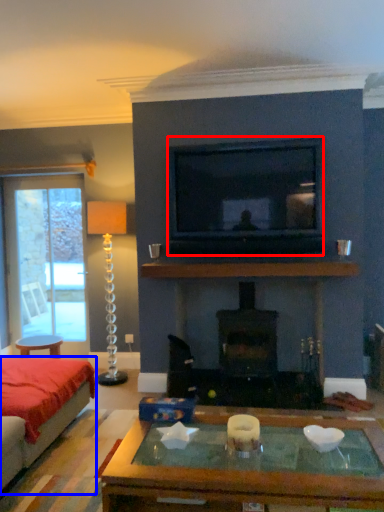
Question: Which point is further to the camera, television (highlighted by a red box) or studio couch (highlighted by a blue box)?

Choices:
 (A) television
 (B) studio couch

Answer: (A)